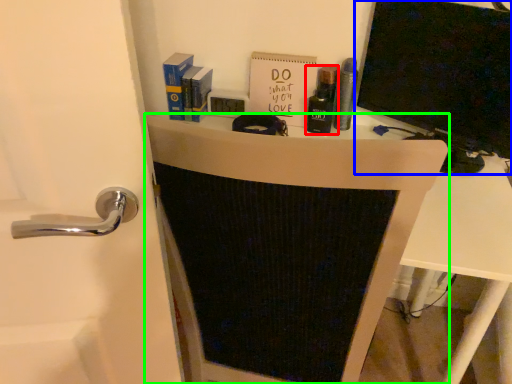
Question: Based on their relative distances, which object is farther from toiletry (highlighted by a red box)? Choose from wide (highlighted by a blue box) and furniture (highlighted by a green box).

Choices:
 (A) wide
 (B) furniture

Answer: (B)